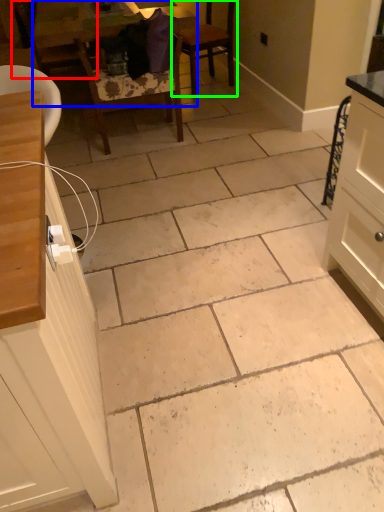
Question: Considering the real-world distances, which object is farthest from chair (highlighted by a red box)? table (highlighted by a blue box) or chair (highlighted by a green box)?

Choices:
 (A) table
 (B) chair

Answer: (B)